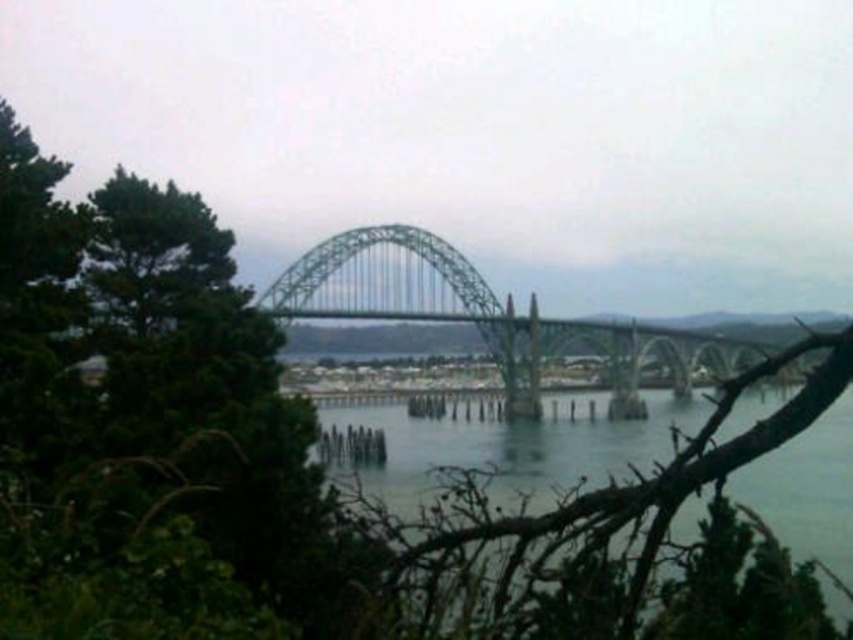
Question: In this image, where is clear water at center located relative to green metallic bridge at center?

Choices:
 (A) left
 (B) right

Answer: (A)

Question: Does clear water at center lie behind green metallic bridge at center?

Choices:
 (A) no
 (B) yes

Answer: (A)

Question: Can you confirm if clear water at center is smaller than green metallic bridge at center?

Choices:
 (A) no
 (B) yes

Answer: (B)

Question: Which point is closer to the camera?

Choices:
 (A) green metallic bridge at center
 (B) clear water at center

Answer: (B)